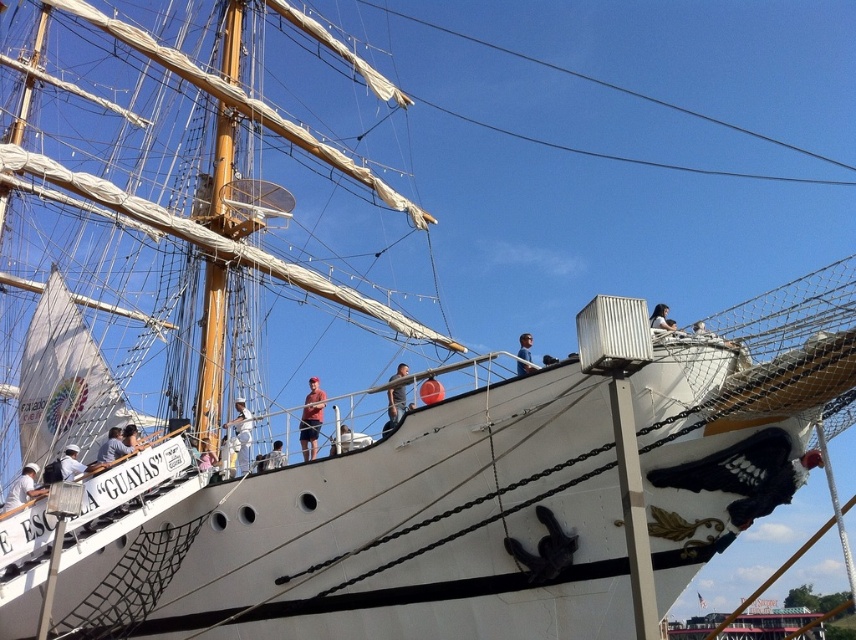
Between matte red helmet at upper center and white matte shirt at upper center, which one has less height?

With less height is white matte shirt at upper center.

Is matte red helmet at upper center in front of white matte shirt at upper center?

Yes, matte red helmet at upper center is in front of white matte shirt at upper center.

Is point (428, 392) less distant than point (276, 460)?

Yes, it is in front of point (276, 460).

Image resolution: width=856 pixels, height=640 pixels. Identify the location of matte red helmet at upper center. (431, 390).

Is point (437, 401) less distant than point (345, 424)?

Yes.

Between matte red helmet at upper center and white matte shirt at center, which one has less height?

With less height is matte red helmet at upper center.

Image resolution: width=856 pixels, height=640 pixels. What are the coordinates of `matte red helmet at upper center` in the screenshot? It's located at (431, 390).

Where is `matte red helmet at upper center`? matte red helmet at upper center is located at coordinates (431, 390).

Does matte red shirt at center appear on the left side of white cloth at upper left?

Incorrect, matte red shirt at center is not on the left side of white cloth at upper left.

Is matte red shirt at center shorter than white cloth at upper left?

No.

This screenshot has width=856, height=640. What are the coordinates of `matte red shirt at center` in the screenshot? It's located at (311, 419).

Find the location of a particular element. matte red shirt at center is located at coordinates (311, 419).